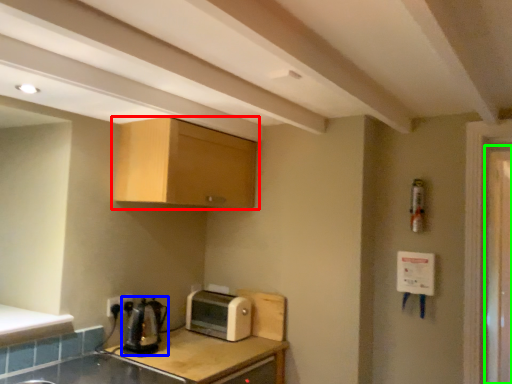
Question: Considering the real-world distances, which object is farthest from cabinetry (highlighted by a red box)? tea pot (highlighted by a blue box) or screen door (highlighted by a green box)?

Choices:
 (A) tea pot
 (B) screen door

Answer: (B)